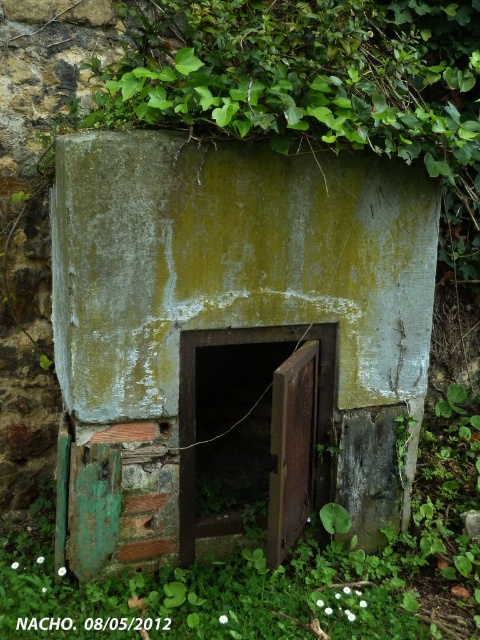
Question: Does green weathered concrete door at center have a larger size compared to green mossy leaves at center?

Choices:
 (A) no
 (B) yes

Answer: (A)

Question: Is green weathered concrete door at center positioned before green mossy leaves at center?

Choices:
 (A) yes
 (B) no

Answer: (A)

Question: Can you confirm if green weathered concrete door at center is wider than green mossy leaves at center?

Choices:
 (A) yes
 (B) no

Answer: (B)

Question: Which point is farther from the camera taking this photo?

Choices:
 (A) (289, 595)
 (B) (115, 419)

Answer: (A)